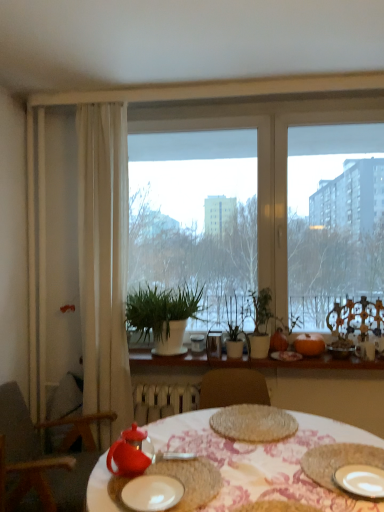
Locate an element on the screen. vacant space that is to the left of white ceramic plate at lower right, the second plate positioned from the left is located at coordinates (298, 485).